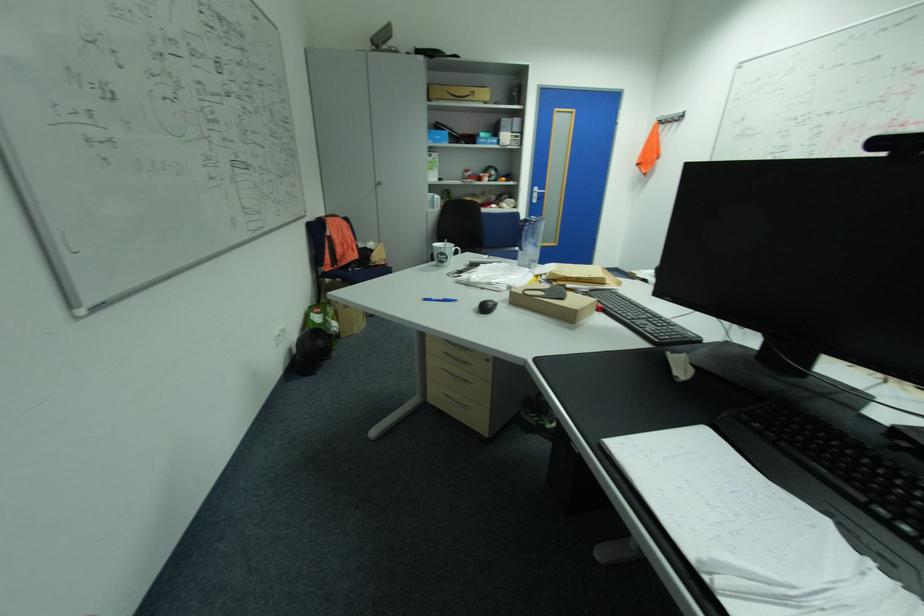
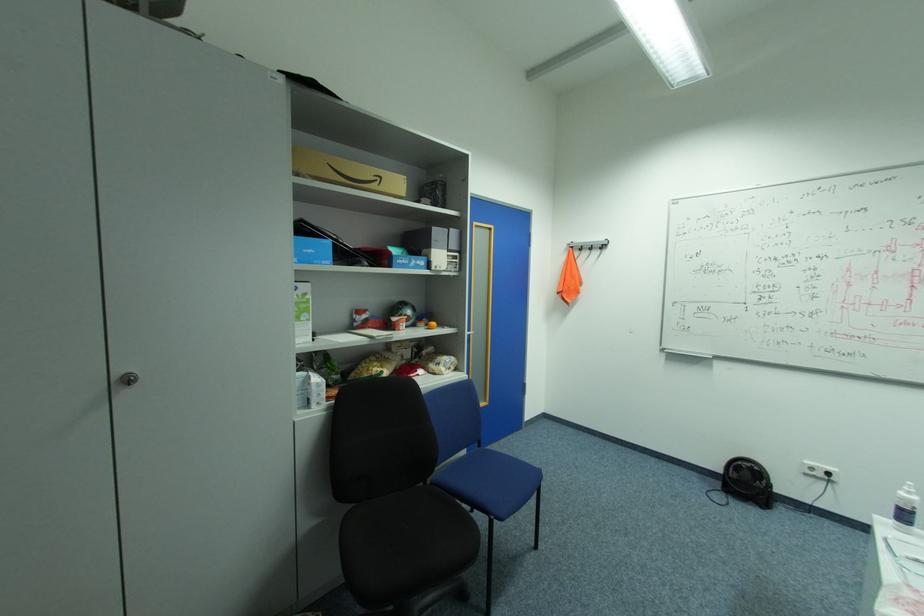
Where in the second image is the point corresponding to (505,180) from the first image?

(429, 323)